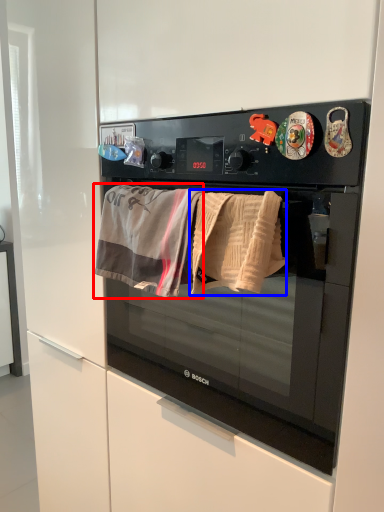
Question: Which object is closer to the camera taking this photo, beach towel (highlighted by a red box) or beach towel (highlighted by a blue box)?

Choices:
 (A) beach towel
 (B) beach towel

Answer: (B)